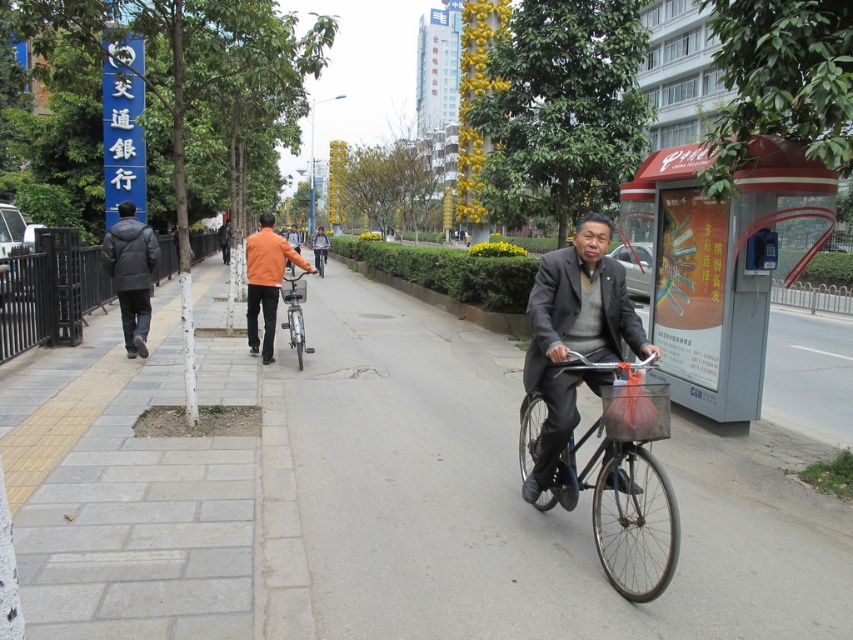
Question: Does dark gray jacket at left have a lesser width compared to silver metallic bicycle at center?

Choices:
 (A) yes
 (B) no

Answer: (A)

Question: Which of the following is the farthest from the observer?

Choices:
 (A) metallic silver bicycle at center
 (B) orange matte jacket at center

Answer: (A)

Question: Based on their relative distances, which object is nearer to the metallic silver bicycle at center?

Choices:
 (A) orange matte jacket at center
 (B) shiny black bicycle at center
 (C) dark gray suit at center
 (D) silver metallic bicycle at center

Answer: (D)

Question: Does gray concrete pavement at center come behind metallic silver bicycle at center?

Choices:
 (A) no
 (B) yes

Answer: (A)

Question: Which point is closer to the camera?

Choices:
 (A) (148, 248)
 (B) (321, 266)

Answer: (A)

Question: Can you confirm if dark gray suit at center is bigger than metallic silver bicycle at center?

Choices:
 (A) yes
 (B) no

Answer: (A)